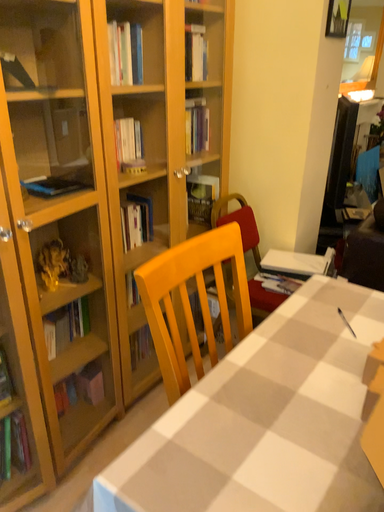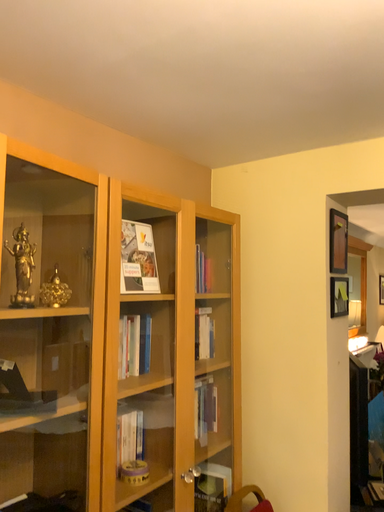
Question: Which way did the camera rotate in the video?

Choices:
 (A) rotated downward
 (B) rotated upward

Answer: (B)